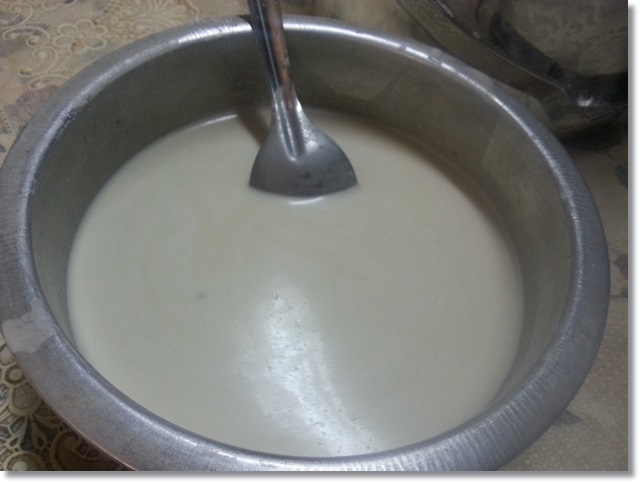
Find the location of a particular element. This screenshot has height=483, width=640. white liquid in bowl is located at coordinates (390, 265), (224, 257), (221, 335), (415, 369).